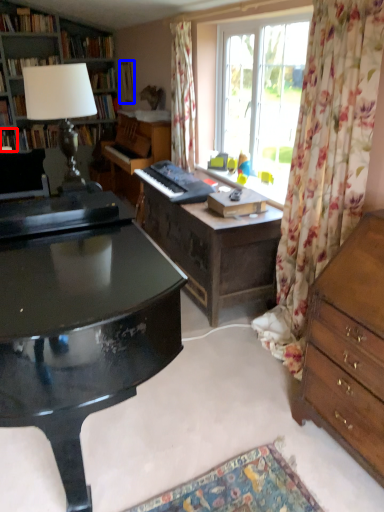
Question: Which point is further to the camera, book (highlighted by a red box) or book (highlighted by a blue box)?

Choices:
 (A) book
 (B) book

Answer: (A)